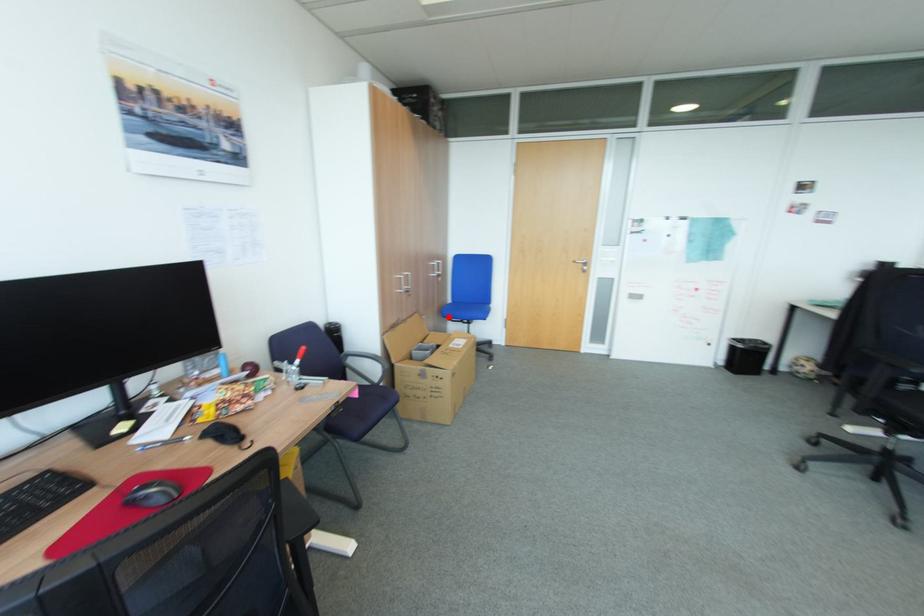
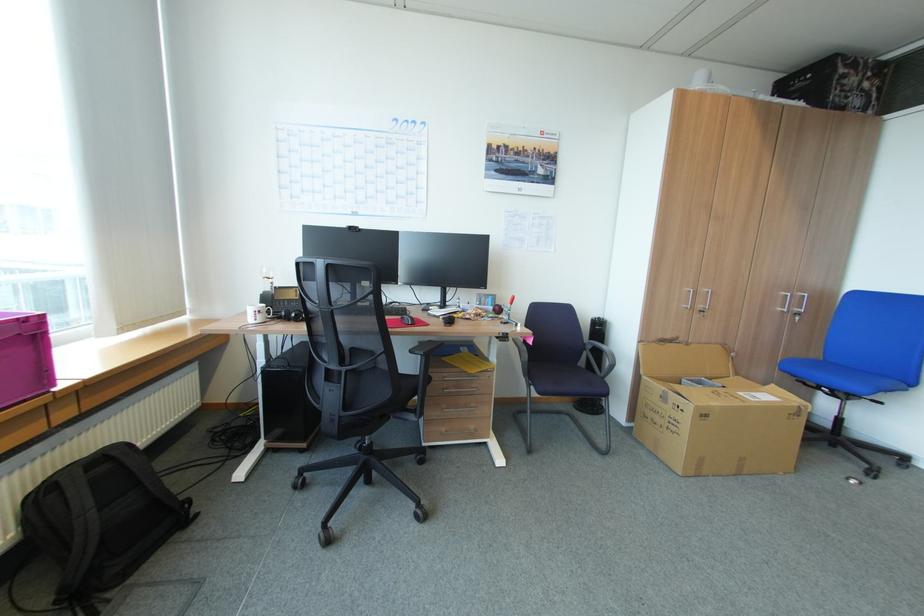
Where in the second image is the point corresponding to the highlighted location from the first image?

(786, 370)